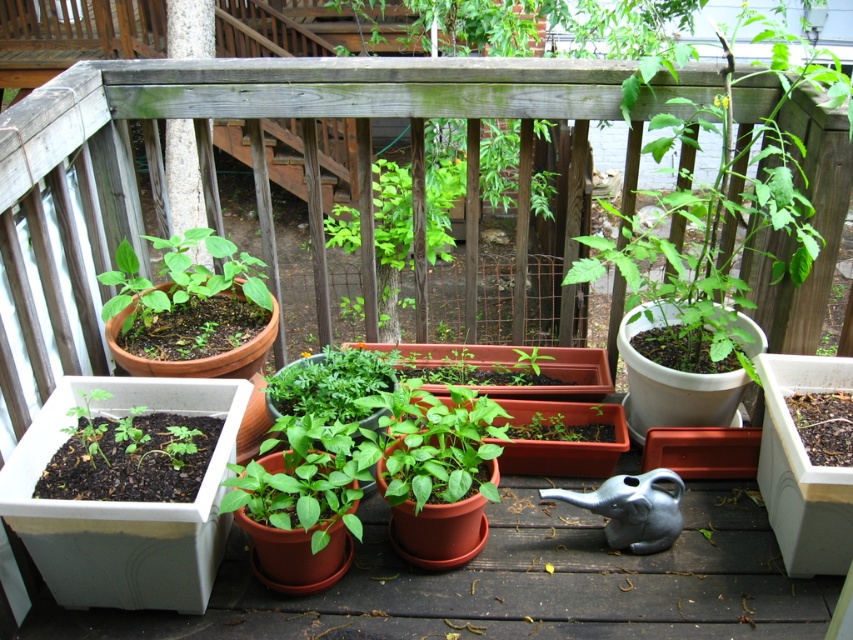
Question: Is green matte plant at center below green matte plant at upper left?

Choices:
 (A) no
 (B) yes

Answer: (A)

Question: Can you confirm if green matte plant at center is thinner than green matte plant at upper left?

Choices:
 (A) no
 (B) yes

Answer: (A)

Question: Can you confirm if green matte plant at center is wider than green matte plant at upper left?

Choices:
 (A) no
 (B) yes

Answer: (B)